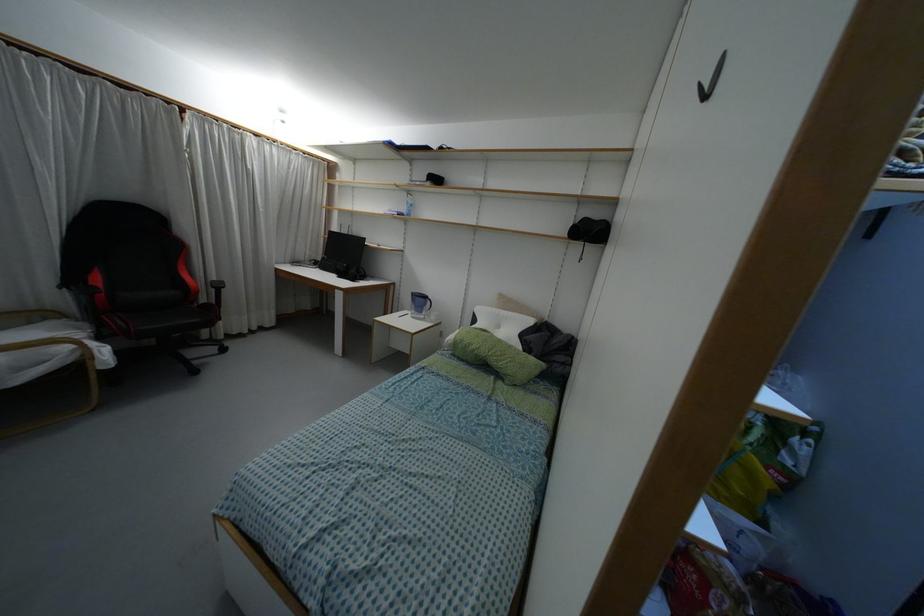
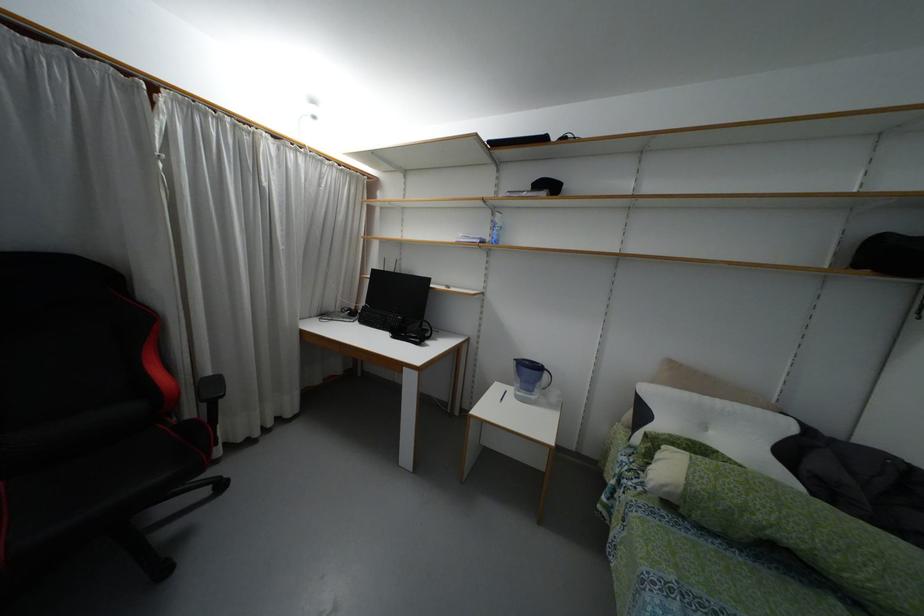
Where in the second image is the point corresponding to (455,337) from the first image?

(687, 483)